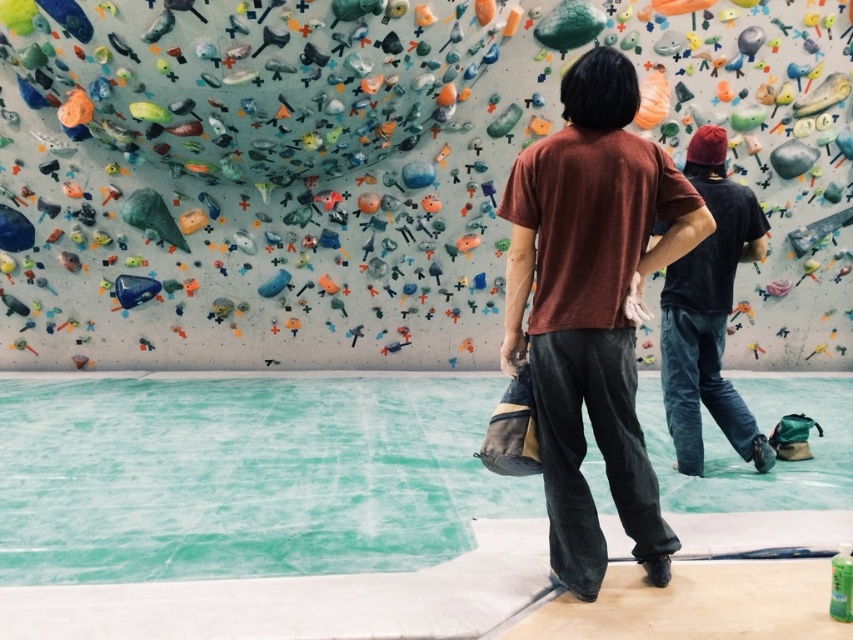
Question: Which point is closer to the camera taking this photo?

Choices:
 (A) (691, 444)
 (B) (599, 340)

Answer: (B)

Question: Is brown cotton t-shirt at center thinner than dark blue jeans at center?

Choices:
 (A) yes
 (B) no

Answer: (B)

Question: Is brown cotton t-shirt at center positioned at the back of dark blue jeans at center?

Choices:
 (A) no
 (B) yes

Answer: (A)

Question: Where is brown cotton t-shirt at center located in relation to dark blue jeans at center in the image?

Choices:
 (A) right
 (B) left

Answer: (B)

Question: Among these objects, which one is nearest to the camera?

Choices:
 (A) brown cotton t-shirt at center
 (B) dark blue jeans at center

Answer: (A)